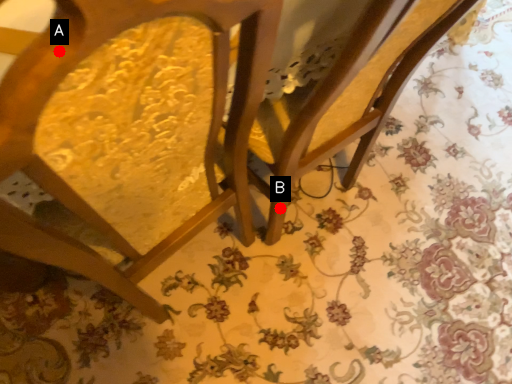
Question: Two points are circled on the image, labeled by A and B beside each circle. Which point is closer to the camera taking this photo?

Choices:
 (A) A is closer
 (B) B is closer

Answer: (A)